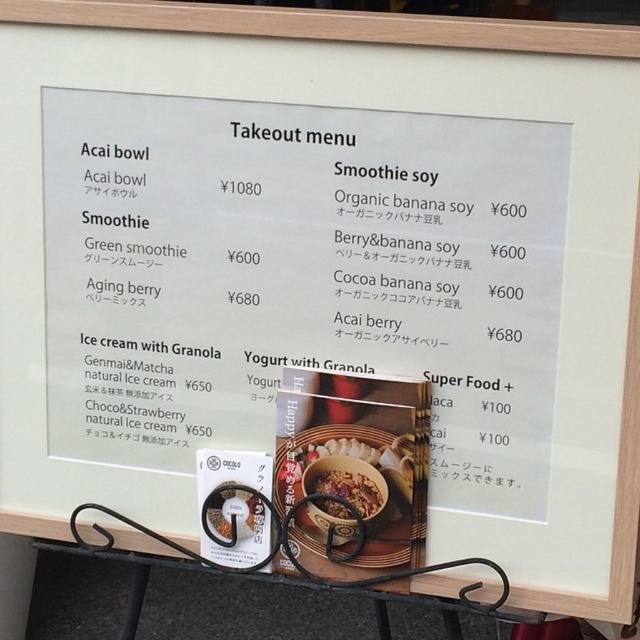
Question: Does smooth granola bowl at center have a greater width compared to matte brown bowl at center?

Choices:
 (A) yes
 (B) no

Answer: (A)

Question: Which of the following is the farthest from the observer?

Choices:
 (A) (321, 444)
 (B) (372, 500)

Answer: (A)

Question: Which of the following is the closest to the observer?

Choices:
 (A) smooth granola bowl at center
 (B) matte brown bowl at center

Answer: (B)

Question: Does smooth granola bowl at center lie in front of matte brown bowl at center?

Choices:
 (A) no
 (B) yes

Answer: (A)

Question: Is the position of smooth granola bowl at center more distant than that of matte brown bowl at center?

Choices:
 (A) yes
 (B) no

Answer: (A)

Question: Which object appears farthest from the camera in this image?

Choices:
 (A) smooth granola bowl at center
 (B) matte brown bowl at center

Answer: (A)